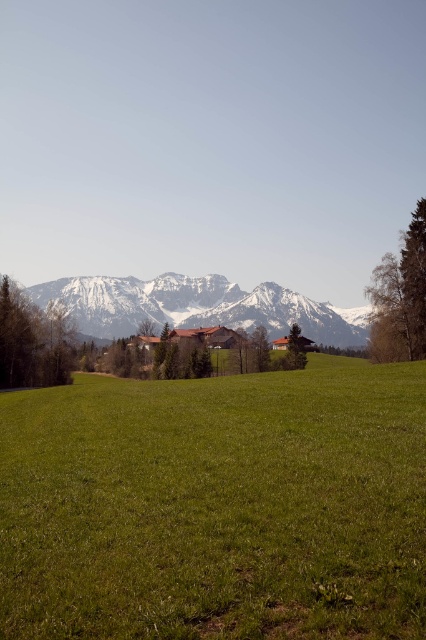
You are standing at the point labeled as point [216,506] in the image. What type of terrain are you currently standing on?

You are standing on the green grassy pasture at center as indicated by the point [216,506].

You are standing in the landscape described and want to take a photo that includes both the green grassy pasture at center and the snowy rock mountain range at center. Which object should you position closer to the left side of your camera frame to capture both in the same shot?

To capture both the green grassy pasture at center and the snowy rock mountain range at center in the same photo, position the snowy rock mountain range at center closer to the left side of your camera frame since the green grassy pasture at center is located to its right.

You are a hiker planning to take a photo of the green grassy pasture at center and the snowy rock mountain range at center. Which one should you focus on if you want to capture the larger object in your shot?

The snowy rock mountain range at center is larger than the green grassy pasture at center, so you should focus on the snowy rock mountain range at center to capture the larger object in your shot.